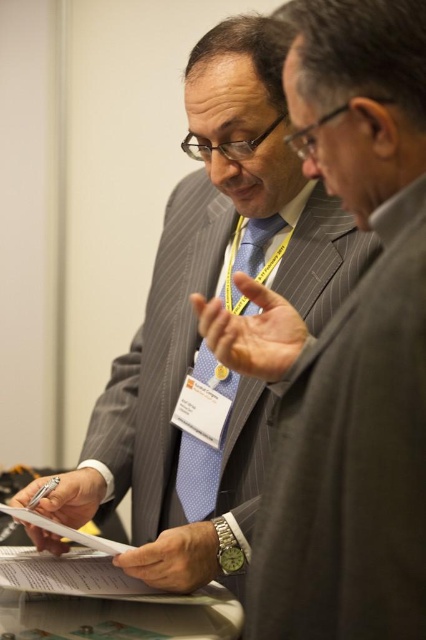
Question: Can you confirm if pinstriped wool suit at center is wider than blue dotted tie at center?

Choices:
 (A) no
 (B) yes

Answer: (A)

Question: Is pinstriped wool suit at center bigger than blue dotted tie at center?

Choices:
 (A) yes
 (B) no

Answer: (A)

Question: Which point is closer to the camera?

Choices:
 (A) (224, 292)
 (B) (345, 416)

Answer: (B)

Question: Can you confirm if pinstriped wool suit at center is smaller than blue dotted tie at center?

Choices:
 (A) no
 (B) yes

Answer: (A)

Question: Which of the following is the closest to the observer?

Choices:
 (A) (402, 358)
 (B) (230, 262)

Answer: (A)